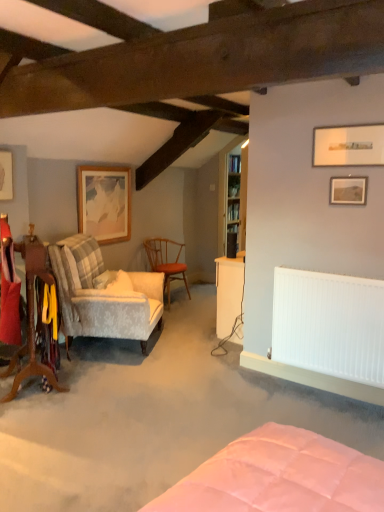
You are a GUI agent. You are given a task and a screenshot of the screen. Output one action in this format:
    pyautogui.click(x=<x>, y=<y>)
    Task: Click on the free location in front of wooden plaid chair at left, marked as the first chair in a front-to-back arrangement
    The image size is (384, 512).
    Given the screenshot: What is the action you would take?
    pyautogui.click(x=34, y=420)